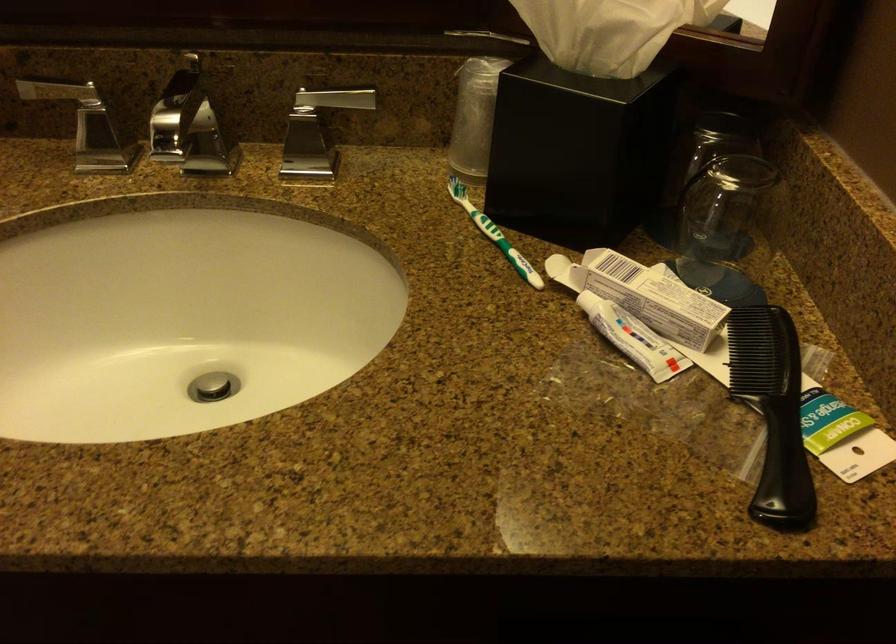
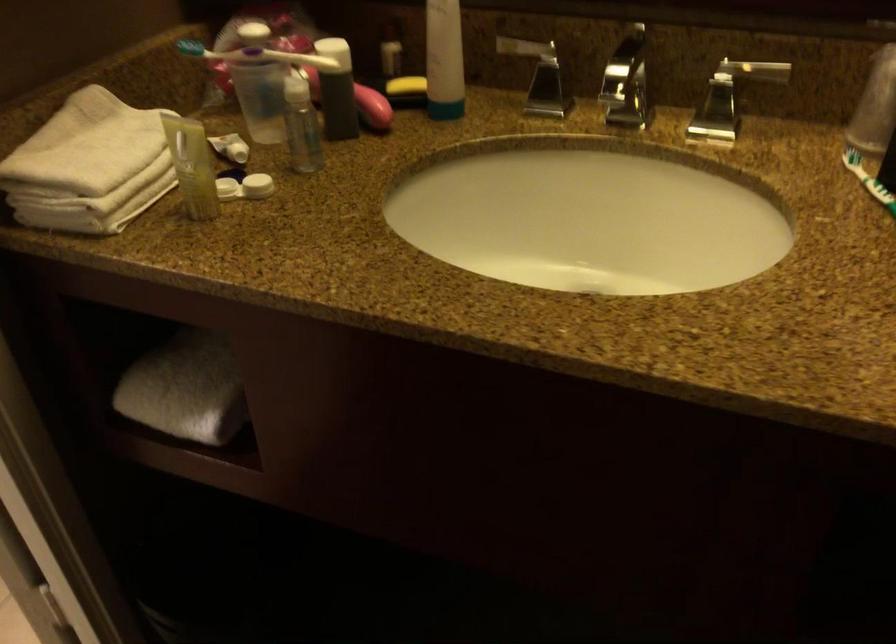
Find the pixel in the second image that matches point 472,212 in the first image.

(867, 180)